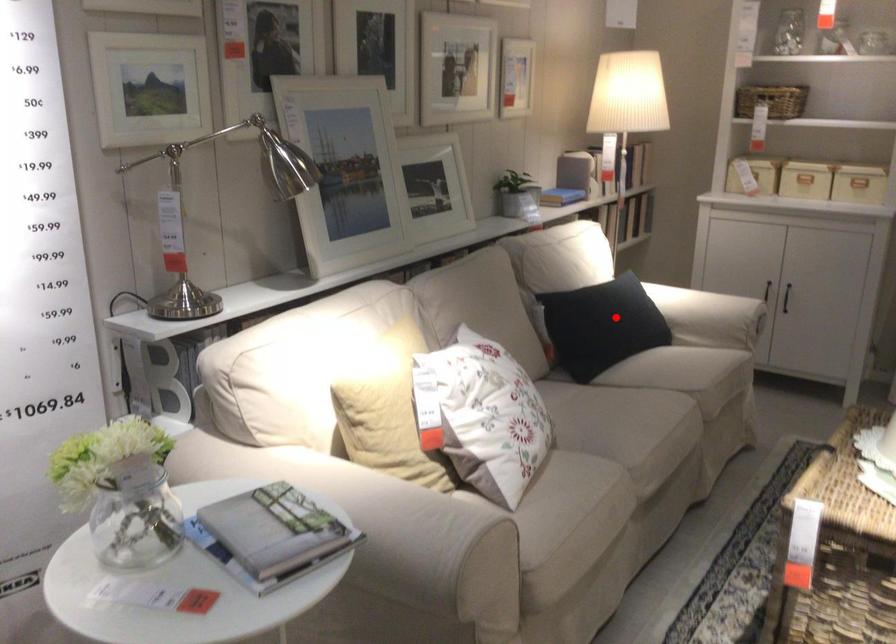
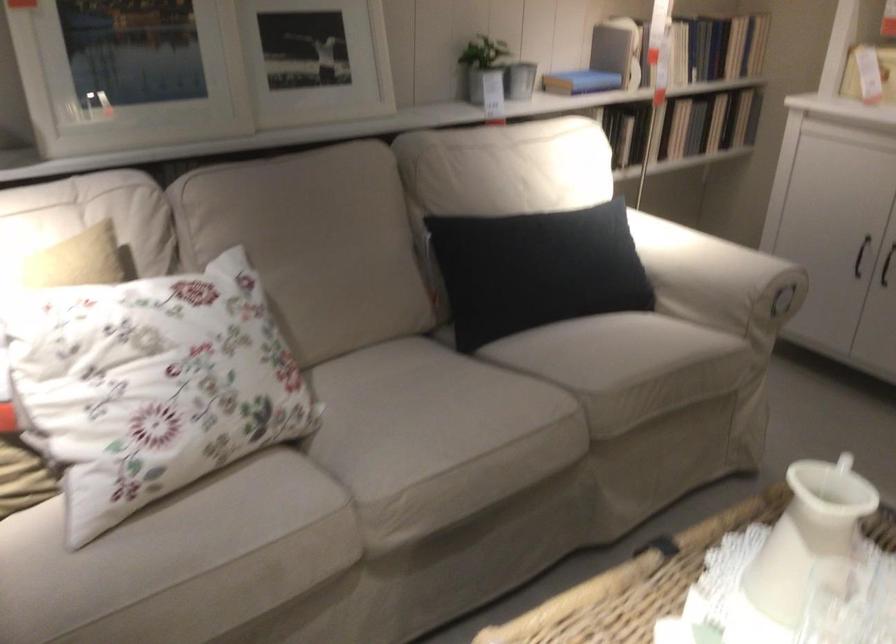
Find the pixel in the second image that matches the highlighted location in the first image.

(536, 270)